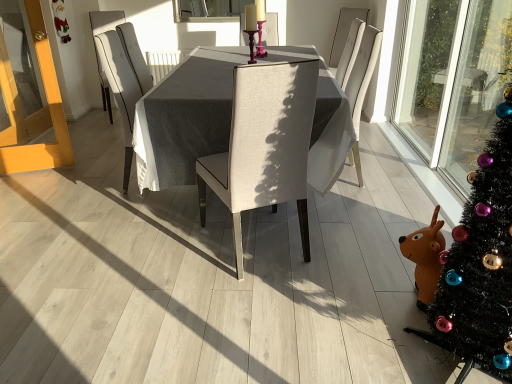
Question: Considering the relative positions of clear glass window screen at upper center and light wood screen door at left in the image provided, is clear glass window screen at upper center in front of light wood screen door at left?

Choices:
 (A) no
 (B) yes

Answer: (A)

Question: Is clear glass window screen at upper center far from light wood screen door at left?

Choices:
 (A) yes
 (B) no

Answer: (A)

Question: Can you confirm if clear glass window screen at upper center is thinner than light wood screen door at left?

Choices:
 (A) yes
 (B) no

Answer: (A)

Question: From a real-world perspective, is clear glass window screen at upper center under light wood screen door at left?

Choices:
 (A) no
 (B) yes

Answer: (A)

Question: Is clear glass window screen at upper center aimed at light wood screen door at left?

Choices:
 (A) no
 (B) yes

Answer: (B)

Question: Considering the positions of textured gray table at center and beige fabric chair at center, which is counted as the 3th chair, starting from the back, in the image, is textured gray table at center taller or shorter than beige fabric chair at center, which is counted as the 3th chair, starting from the back,?

Choices:
 (A) tall
 (B) short

Answer: (B)

Question: In terms of width, does textured gray table at center look wider or thinner when compared to beige fabric chair at center, the second chair viewed from the left?

Choices:
 (A) thin
 (B) wide

Answer: (B)

Question: Considering the positions of point (207, 129) and point (222, 178), is point (207, 129) closer or farther from the camera than point (222, 178)?

Choices:
 (A) farther
 (B) closer

Answer: (A)

Question: Choose the correct answer: Is textured gray table at center inside beige fabric chair at center, the 2th chair from the right, or outside it?

Choices:
 (A) inside
 (B) outside

Answer: (B)

Question: From a real-world perspective, relative to white fabric chair at center, positioned as the third chair in front-to-back order, is clear glass window screen at upper center vertically above or below?

Choices:
 (A) above
 (B) below

Answer: (A)

Question: From the image's perspective, is clear glass window screen at upper center located above or below white fabric chair at center, arranged as the 1th chair when viewed from the left?

Choices:
 (A) below
 (B) above

Answer: (B)

Question: Is clear glass window screen at upper center spatially inside white fabric chair at center, arranged as the 1th chair when viewed from the back, or outside of it?

Choices:
 (A) inside
 (B) outside

Answer: (B)

Question: Relative to white fabric chair at center, which ranks as the 3th chair in right-to-left order, is clear glass window screen at upper center in front or behind?

Choices:
 (A) behind
 (B) front

Answer: (A)

Question: From a real-world perspective, relative to textured gray table at center, is beige fabric chair at center, which is counted as the 3th chair, starting from the back, vertically above or below?

Choices:
 (A) below
 (B) above

Answer: (B)

Question: Considering the positions of point (249, 81) and point (194, 150), is point (249, 81) closer or farther from the camera than point (194, 150)?

Choices:
 (A) closer
 (B) farther

Answer: (A)